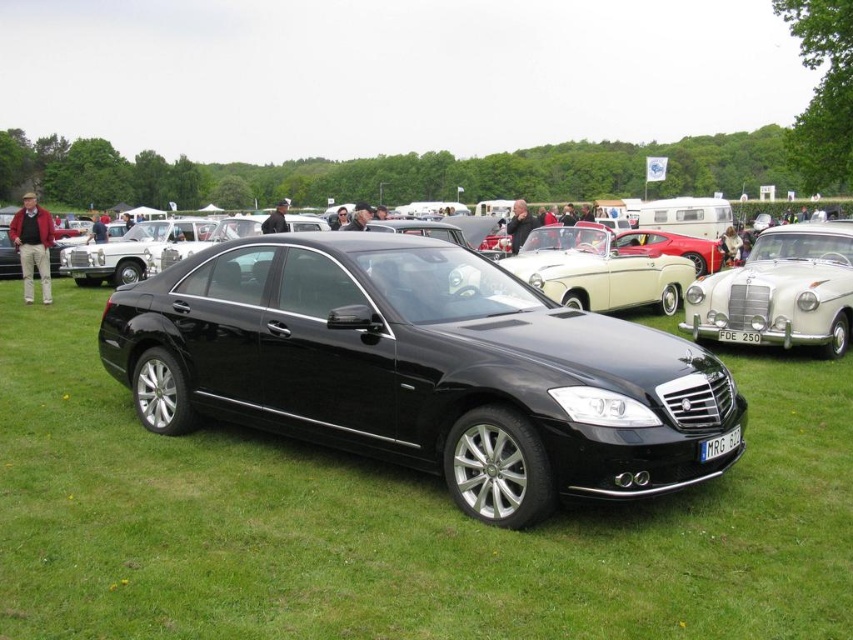
You are standing at the entrance of the car show and see the point marked at coordinates (x=782, y=289). What does this point indicate?

The point at coordinates (x=782, y=289) indicates the location of the silver metallic vintage car at center.

You are at a car show and want to take a photo of both the silver metallic vintage car at center and the black metallic sedan at center. Which car should you focus on first if you want to capture both in a single frame without moving your camera?

The silver metallic vintage car at center is smaller than the black metallic sedan at center, so you should focus on the black metallic sedan at center first as it occupies more space in the frame, allowing the smaller vintage car to fit alongside it.